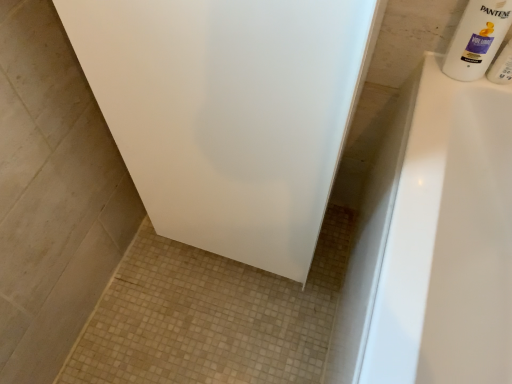
Locate an element on the screen. The image size is (512, 384). white glossy shampoo bottle at upper right is located at coordinates (477, 38).

What do you see at coordinates (477, 38) in the screenshot? The height and width of the screenshot is (384, 512). I see `white glossy shampoo bottle at upper right` at bounding box center [477, 38].

What is the approximate height of white plastic bottle at upper right?

3.70 inches.

The height and width of the screenshot is (384, 512). What do you see at coordinates (502, 66) in the screenshot?
I see `white plastic bottle at upper right` at bounding box center [502, 66].

In order to face white plastic bottle at upper right, should I rotate leftwards or rightwards?

It's best to rotate right around 31.031 degrees.

This screenshot has height=384, width=512. I want to click on white plastic bottle at upper right, so [502, 66].

Locate an element on the screen. The image size is (512, 384). white glossy shampoo bottle at upper right is located at coordinates (477, 38).

Is white glossy shampoo bottle at upper right to the left or to the right of white plastic bottle at upper right in the image?

Clearly, white glossy shampoo bottle at upper right is on the left of white plastic bottle at upper right in the image.

Looking at this image, considering the relative positions of white glossy shampoo bottle at upper right and white plastic bottle at upper right in the image provided, is white glossy shampoo bottle at upper right in front of white plastic bottle at upper right?

Yes, it is.

Which is in front, point (447, 54) or point (494, 66)?

The point (494, 66) is closer to the camera.

From the image's perspective, is white glossy shampoo bottle at upper right located beneath white plastic bottle at upper right?

Actually, white glossy shampoo bottle at upper right appears above white plastic bottle at upper right in the image.

From the picture: From a real-world perspective, which is physically above, white glossy shampoo bottle at upper right or white plastic bottle at upper right?

white glossy shampoo bottle at upper right, from a real-world perspective.

Which of these two, white glossy shampoo bottle at upper right or white plastic bottle at upper right, is wider?

With larger width is white glossy shampoo bottle at upper right.

In terms of height, does white glossy shampoo bottle at upper right look taller or shorter compared to white plastic bottle at upper right?

white glossy shampoo bottle at upper right is taller than white plastic bottle at upper right.

Between white glossy shampoo bottle at upper right and white plastic bottle at upper right, which one has larger size?

white glossy shampoo bottle at upper right is bigger.

Choose the correct answer: Is white glossy shampoo bottle at upper right inside white plastic bottle at upper right or outside it?

white glossy shampoo bottle at upper right is not enclosed by white plastic bottle at upper right.

Is white glossy shampoo bottle at upper right not near white plastic bottle at upper right?

No.

Could you tell me if white glossy shampoo bottle at upper right is facing white plastic bottle at upper right?

No, white glossy shampoo bottle at upper right is not oriented towards white plastic bottle at upper right.

Can you tell me how much white glossy shampoo bottle at upper right and white plastic bottle at upper right differ in facing direction?

They differ by 1.36 degrees in their facing directions.

Measure the distance from white glossy shampoo bottle at upper right to white plastic bottle at upper right.

white glossy shampoo bottle at upper right is 2.23 inches from white plastic bottle at upper right.

Locate an element on the screen. cleaning product in front of the white plastic bottle at upper right is located at coordinates (477, 38).

Which object is positioned more to the left, white plastic bottle at upper right or white glossy shampoo bottle at upper right?

Positioned to the left is white glossy shampoo bottle at upper right.

Considering their positions, is white plastic bottle at upper right located in front of or behind white glossy shampoo bottle at upper right?

In the image, white plastic bottle at upper right appears behind white glossy shampoo bottle at upper right.

Considering the positions of points (504, 53) and (477, 6), is point (504, 53) farther from camera compared to point (477, 6)?

Yes.

From the picture: From the image's perspective, which is below, white plastic bottle at upper right or white glossy shampoo bottle at upper right?

white plastic bottle at upper right appears lower in the image.

From a real-world perspective, relative to white glossy shampoo bottle at upper right, is white plastic bottle at upper right vertically above or below?

white plastic bottle at upper right is below white glossy shampoo bottle at upper right.

Is white plastic bottle at upper right wider than white glossy shampoo bottle at upper right?

No, white plastic bottle at upper right is not wider than white glossy shampoo bottle at upper right.

Between white plastic bottle at upper right and white glossy shampoo bottle at upper right, which one has more height?

Standing taller between the two is white glossy shampoo bottle at upper right.

Considering the relative sizes of white plastic bottle at upper right and white glossy shampoo bottle at upper right in the image provided, is white plastic bottle at upper right bigger than white glossy shampoo bottle at upper right?

Actually, white plastic bottle at upper right might be smaller than white glossy shampoo bottle at upper right.

Is white plastic bottle at upper right surrounding white glossy shampoo bottle at upper right?

No, white glossy shampoo bottle at upper right is located outside of white plastic bottle at upper right.

Would you say white plastic bottle at upper right is a long distance from white glossy shampoo bottle at upper right?

No.

Does white plastic bottle at upper right turn towards white glossy shampoo bottle at upper right?

No.

Where is `toiletry that appears on the right of white glossy shampoo bottle at upper right`? Image resolution: width=512 pixels, height=384 pixels. toiletry that appears on the right of white glossy shampoo bottle at upper right is located at coordinates (502, 66).

Where is `cleaning product to the left of white plastic bottle at upper right`? The width and height of the screenshot is (512, 384). cleaning product to the left of white plastic bottle at upper right is located at coordinates (477, 38).

Where is `toiletry behind the white glossy shampoo bottle at upper right`? The image size is (512, 384). toiletry behind the white glossy shampoo bottle at upper right is located at coordinates click(502, 66).